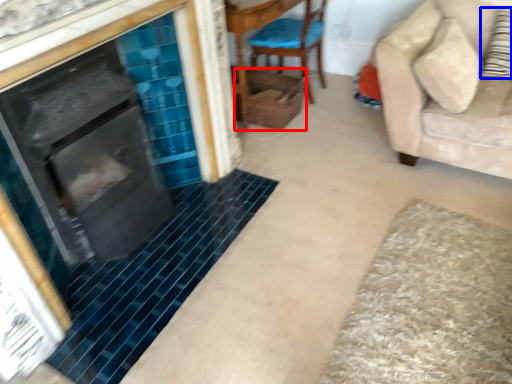
Question: Among these objects, which one is nearest to the camera, basket (highlighted by a red box) or pillow (highlighted by a blue box)?

Choices:
 (A) basket
 (B) pillow

Answer: (B)